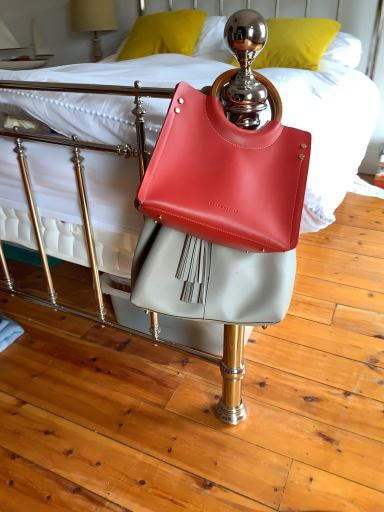
Question: Is matte beige lampshade at upper left not close to matte yellow pillow at upper center, which is counted as the second pillow, starting from the right?

Choices:
 (A) no
 (B) yes

Answer: (A)

Question: Is matte yellow pillow at upper center, which is the first pillow in left-to-right order, completely or partially inside matte beige lampshade at upper left?

Choices:
 (A) no
 (B) yes

Answer: (A)

Question: Is matte beige lampshade at upper left not inside matte yellow pillow at upper center, which is counted as the second pillow, starting from the right?

Choices:
 (A) no
 (B) yes

Answer: (B)

Question: Can you confirm if matte beige lampshade at upper left is taller than matte yellow pillow at upper center, which is the first pillow in left-to-right order?

Choices:
 (A) no
 (B) yes

Answer: (B)

Question: From a real-world perspective, is matte beige lampshade at upper left over matte yellow pillow at upper center, which is the first pillow in left-to-right order?

Choices:
 (A) yes
 (B) no

Answer: (B)

Question: Would you say metallic gold pillow at upper center, acting as the 1th pillow starting from the right, is to the left or to the right of matte yellow pillow at upper center, which is counted as the second pillow, starting from the right, in the picture?

Choices:
 (A) left
 (B) right

Answer: (B)

Question: From a real-world perspective, is metallic gold pillow at upper center, acting as the 1th pillow starting from the right, physically located above or below matte yellow pillow at upper center, which is the first pillow in left-to-right order?

Choices:
 (A) below
 (B) above

Answer: (A)

Question: Choose the correct answer: Is metallic gold pillow at upper center, acting as the 1th pillow starting from the right, inside matte yellow pillow at upper center, which is the first pillow in left-to-right order, or outside it?

Choices:
 (A) outside
 (B) inside

Answer: (A)

Question: In terms of width, does metallic gold pillow at upper center, acting as the 1th pillow starting from the right, look wider or thinner when compared to matte yellow pillow at upper center, which is counted as the second pillow, starting from the right?

Choices:
 (A) wide
 (B) thin

Answer: (A)

Question: Based on their sizes in the image, would you say matte leather handbag at center is bigger or smaller than metallic gold pillow at upper center, acting as the 1th pillow starting from the right?

Choices:
 (A) big
 (B) small

Answer: (B)

Question: Visually, is matte leather handbag at center positioned to the left or to the right of metallic gold pillow at upper center, acting as the second pillow starting from the left?

Choices:
 (A) right
 (B) left

Answer: (B)

Question: Considering the positions of matte leather handbag at center and metallic gold pillow at upper center, acting as the 1th pillow starting from the right, in the image, is matte leather handbag at center wider or thinner than metallic gold pillow at upper center, acting as the 1th pillow starting from the right,?

Choices:
 (A) wide
 (B) thin

Answer: (B)

Question: From a real-world perspective, is matte leather handbag at center above or below metallic gold pillow at upper center, acting as the second pillow starting from the left?

Choices:
 (A) below
 (B) above

Answer: (A)

Question: From a real-world perspective, relative to matte leather handbag at center, is metallic gold pillow at upper center, acting as the second pillow starting from the left, vertically above or below?

Choices:
 (A) above
 (B) below

Answer: (A)

Question: Based on their sizes in the image, would you say metallic gold pillow at upper center, acting as the 1th pillow starting from the right, is bigger or smaller than matte leather handbag at center?

Choices:
 (A) big
 (B) small

Answer: (A)